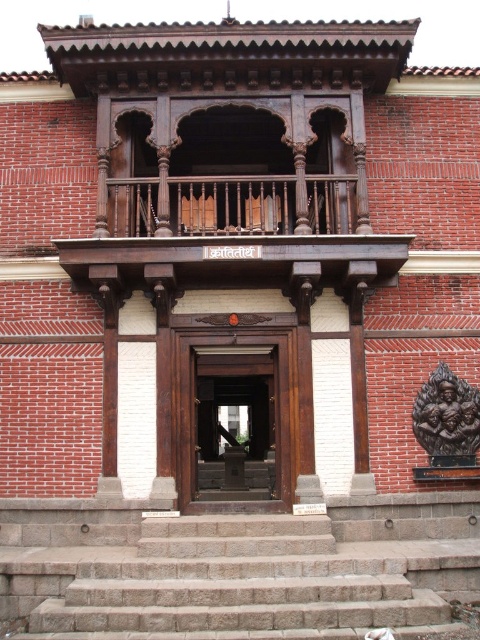
Is point (203, 346) more distant than point (225, 208)?

No, it is not.

Is point (176, 344) in front of point (307, 208)?

No.

Describe the element at coordinates (236, 403) in the screenshot. I see `dark wood door at center` at that location.

This screenshot has height=640, width=480. What are the coordinates of `dark wood door at center` in the screenshot? It's located at (236, 403).

Who is more distant from viewer, (415, 589) or (208, 182)?

Point (208, 182)

Between brown stone stairs at lower center and polished wood railing at upper center, which one appears on the right side from the viewer's perspective?

polished wood railing at upper center

The height and width of the screenshot is (640, 480). What do you see at coordinates (239, 572) in the screenshot? I see `brown stone stairs at lower center` at bounding box center [239, 572].

What are the coordinates of `brown stone stairs at lower center` in the screenshot? It's located at (239, 572).

Who is lower down, brown stone stairs at lower center or dark wood door at center?

brown stone stairs at lower center

Is brown stone stairs at lower center above dark wood door at center?

No.

Where is `brown stone stairs at lower center`? brown stone stairs at lower center is located at coordinates (239, 572).

Locate an element on the screen. brown stone stairs at lower center is located at coordinates (239, 572).